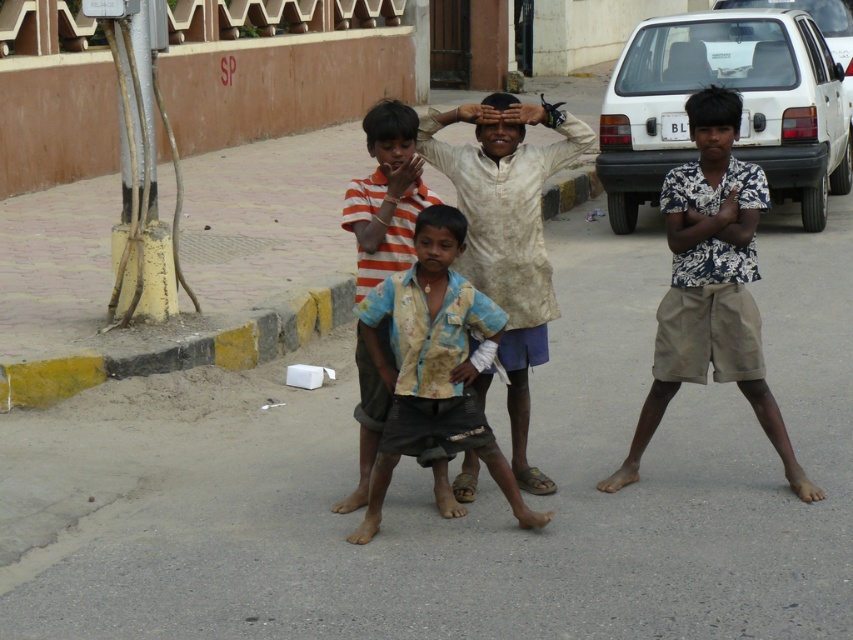
Question: Does white matte car at right appear on the right side of rusty fabric shirt at center?

Choices:
 (A) yes
 (B) no

Answer: (A)

Question: Which point is farther from the camera taking this photo?

Choices:
 (A) (846, 13)
 (B) (401, 208)
 (C) (816, 51)
 (D) (535, 481)

Answer: (A)

Question: Which object is closer to the camera taking this photo?

Choices:
 (A) white matte car at upper right
 (B) white matte car at right

Answer: (B)

Question: Which of the following is the farthest from the observer?

Choices:
 (A) white matte car at upper right
 (B) rusty fabric shirt at center

Answer: (A)

Question: Is rusty fabric shirt at center positioned in front of light beige fabric shirt at center?

Choices:
 (A) yes
 (B) no

Answer: (A)

Question: From the image, what is the correct spatial relationship of rusty fabric shirt at center in relation to white matte car at upper right?

Choices:
 (A) above
 (B) below

Answer: (B)